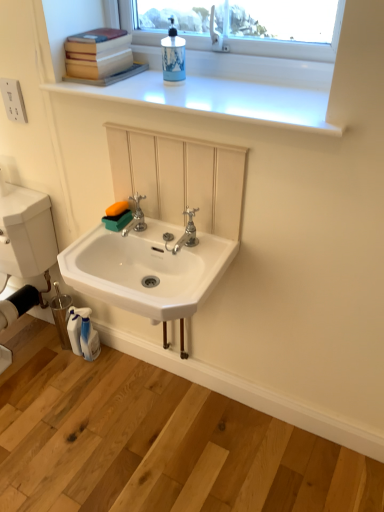
I want to click on vacant space to the right of blue ceramic soap dispenser at upper center, so click(x=217, y=87).